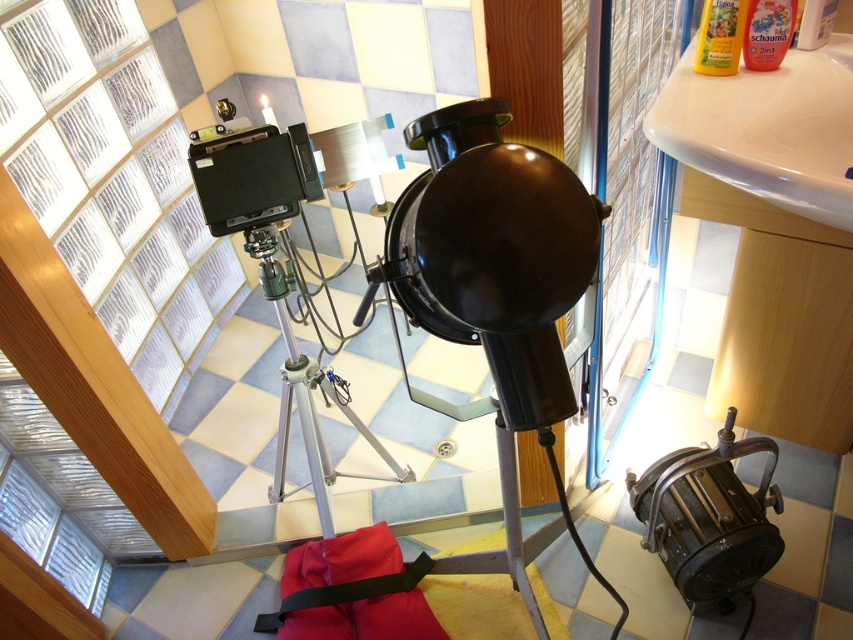
Question: Which of these objects is positioned farthest from the matte red bag at lower center?

Choices:
 (A) metallic brass lamp at lower right
 (B) matte black spotlight at center
 (C) white glossy sink at upper right
 (D) silver metallic tripod at center

Answer: (C)

Question: Does white glossy sink at upper right have a lesser width compared to matte red bag at lower center?

Choices:
 (A) no
 (B) yes

Answer: (B)

Question: Is matte red bag at lower center to the left of silver metallic tripod at center from the viewer's perspective?

Choices:
 (A) no
 (B) yes

Answer: (A)

Question: Which object is closer to the camera taking this photo?

Choices:
 (A) metallic brass lamp at lower right
 (B) matte red bag at lower center

Answer: (A)

Question: Among these objects, which one is nearest to the camera?

Choices:
 (A) metallic brass lamp at lower right
 (B) matte black spotlight at center

Answer: (B)

Question: Is matte red bag at lower center smaller than silver metallic tripod at center?

Choices:
 (A) yes
 (B) no

Answer: (A)